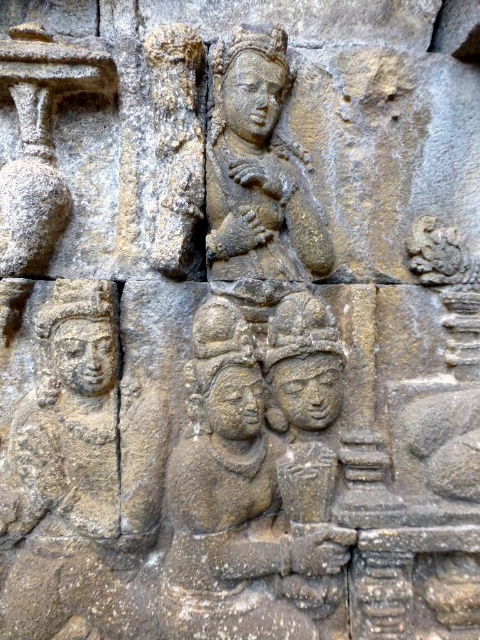
Based on the scene described, which object is positioned to the right of the other? Please refer to the spatial relationship between the gray stone figures at center and the gray stone statue at upper center.

The gray stone figures at center are positioned to the right of the gray stone statue at upper center.

You are an archaeologist examining the ancient stone carving. You notice two gray stone figures mentioned in the scene. Which one is larger in size between the gray stone figures at center and the gray stone statue at upper center?

The gray stone figures at center is bigger than the gray stone statue at upper center according to the description.

Based on the scene described, which object is taller, the gray stone figures at center or the gray stone statue at upper center?

The gray stone figures at center is much taller than the gray stone statue at upper center according to the description.